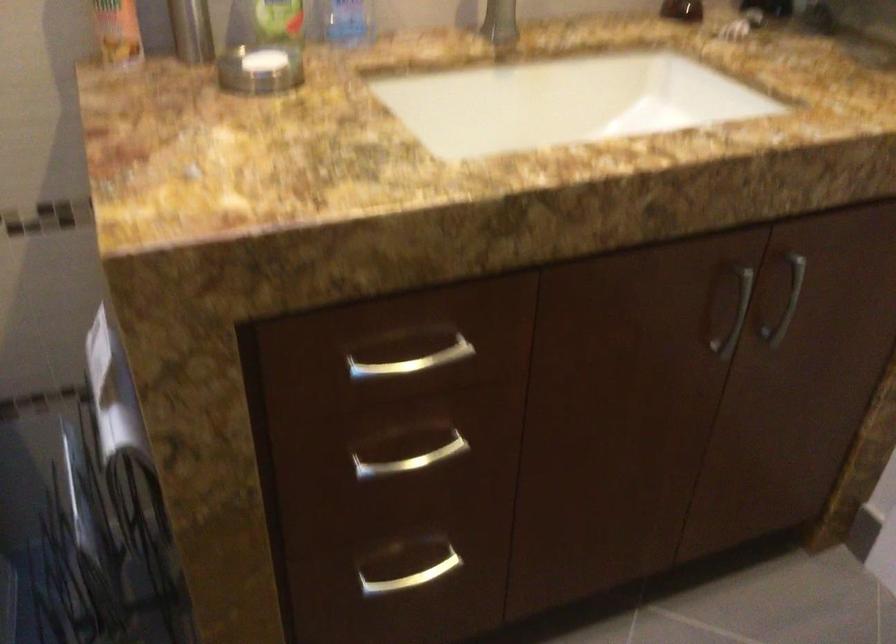
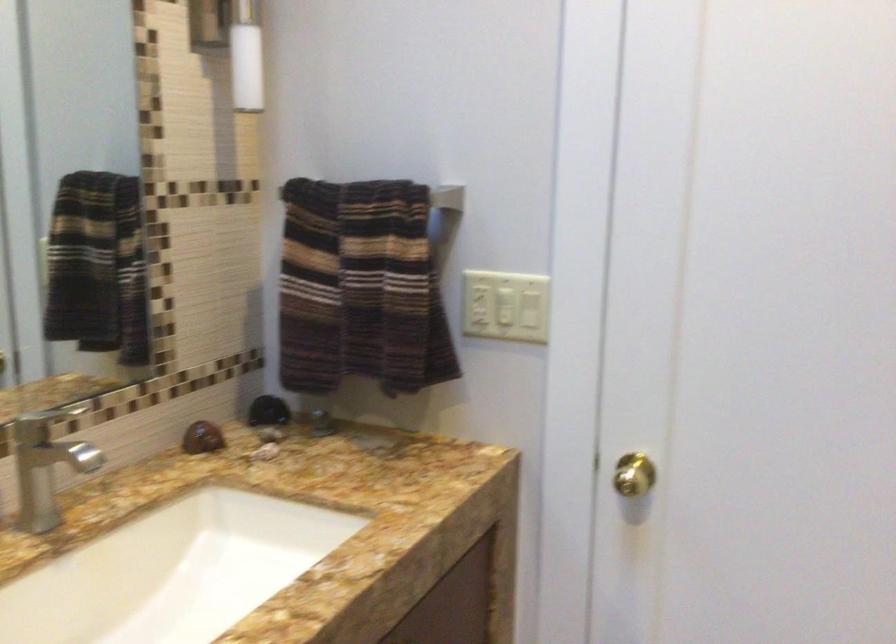
Question: How did the camera likely rotate?

Choices:
 (A) Left
 (B) Right
 (C) Up
 (D) Down

Answer: (B)